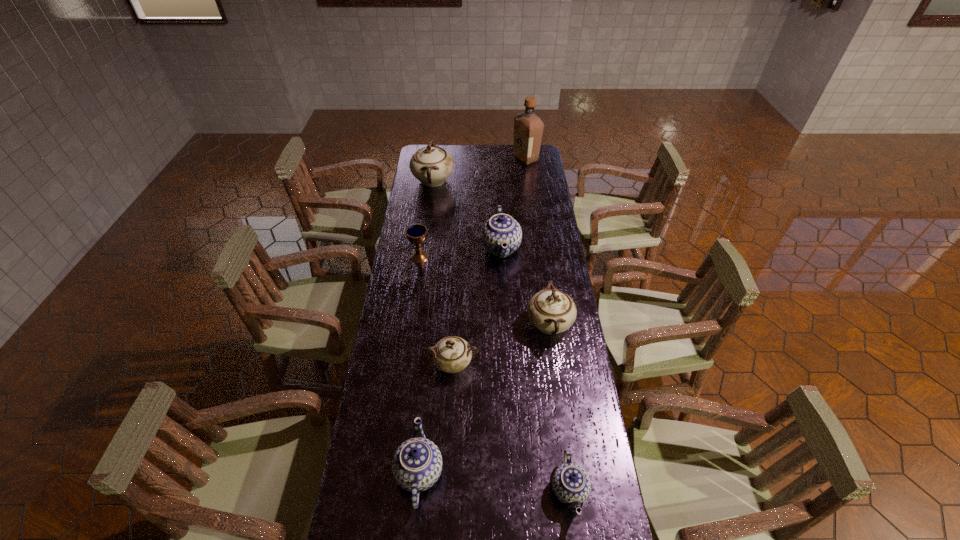
Identify the location of vacant space located 0.310m on the right of the chalice. This screenshot has width=960, height=540. (501, 257).

The width and height of the screenshot is (960, 540). I want to click on free point located 0.380m at the spout of the second smallest blue chinaware, so click(x=572, y=472).

Identify the location of blank space located 0.100m on the left of the smallest white chinaware. [399, 364].

The width and height of the screenshot is (960, 540). In order to click on vacant space located at the spout of the smallest blue chinaware in this screenshot , I will do `click(436, 490)`.

You are a GUI agent. You are given a task and a screenshot of the screen. Output one action in this format:
    pyautogui.click(x=<x>, y=<y>)
    Task: Click on the vacant area located at the spout of the smallest blue chinaware
    The width and height of the screenshot is (960, 540).
    Given the screenshot: What is the action you would take?
    pyautogui.click(x=484, y=490)

What are the coordinates of `free space located at the spout of the smallest blue chinaware` in the screenshot? It's located at (498, 490).

Where is `liquor that is at the far edge`? The image size is (960, 540). liquor that is at the far edge is located at coordinates (528, 128).

Identify the location of chinaware present at the far edge. (431, 165).

This screenshot has width=960, height=540. I want to click on chalice situated at the left edge, so click(417, 233).

This screenshot has height=540, width=960. Identify the location of liquor located at the right edge. 528,128.